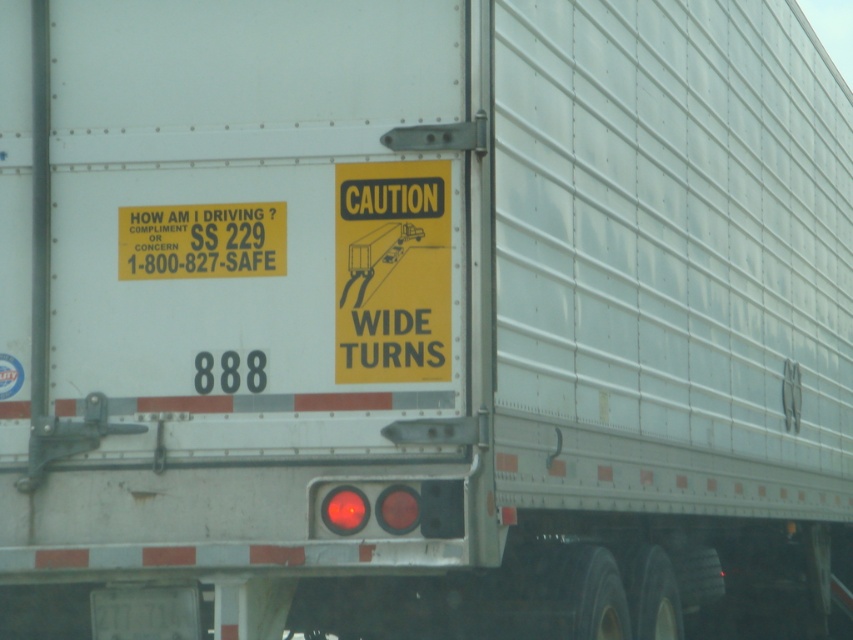
Question: Is yellow paper caution sign at center bigger than white matte license plate at lower center?

Choices:
 (A) no
 (B) yes

Answer: (B)

Question: Which point appears farthest from the camera in this image?

Choices:
 (A) (171, 212)
 (B) (434, 323)

Answer: (A)

Question: Is yellow paper caution sign at center smaller than yellow paper sign at left?

Choices:
 (A) yes
 (B) no

Answer: (B)

Question: Estimate the real-world distances between objects in this image. Which object is farther from the yellow paper sign at left?

Choices:
 (A) yellow paper caution sign at center
 (B) white matte license plate at lower center

Answer: (B)

Question: Is yellow paper sign at left wider than white matte license plate at lower center?

Choices:
 (A) yes
 (B) no

Answer: (A)

Question: Estimate the real-world distances between objects in this image. Which object is closer to the yellow paper sign at left?

Choices:
 (A) yellow paper caution sign at center
 (B) white matte license plate at lower center

Answer: (A)